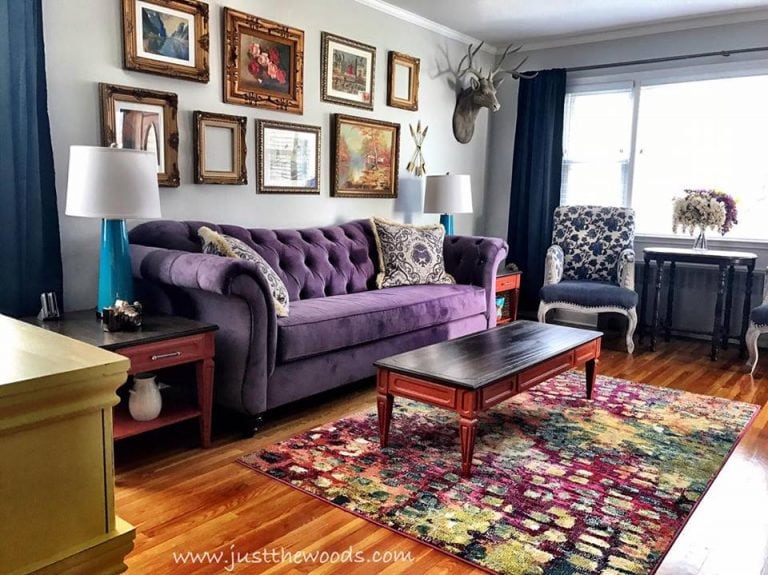
Find the location of a particular element. purple couch is located at coordinates (300, 252).